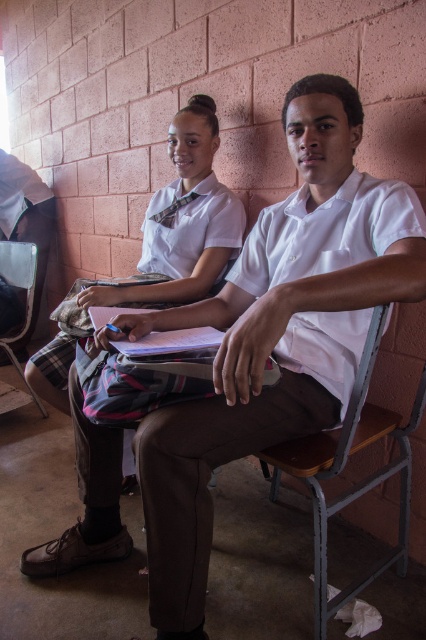
Question: Which is nearer to the metallic gray chair at lower left?

Choices:
 (A) white glossy shirt at upper center
 (B) wooden seat at lower right

Answer: (A)

Question: Which point is closer to the camera?

Choices:
 (A) wooden seat at lower right
 (B) white glossy shirt at upper center

Answer: (A)

Question: Does wooden seat at lower right have a larger size compared to metallic gray chair at lower left?

Choices:
 (A) no
 (B) yes

Answer: (A)

Question: Can you confirm if wooden seat at lower right is positioned to the left of metallic gray chair at lower left?

Choices:
 (A) yes
 (B) no

Answer: (B)

Question: Is white glossy shirt at upper center smaller than metallic gray chair at lower left?

Choices:
 (A) yes
 (B) no

Answer: (A)

Question: Which point is closer to the camera taking this photo?

Choices:
 (A) (32, 278)
 (B) (325, 579)
 (C) (184, 278)

Answer: (B)